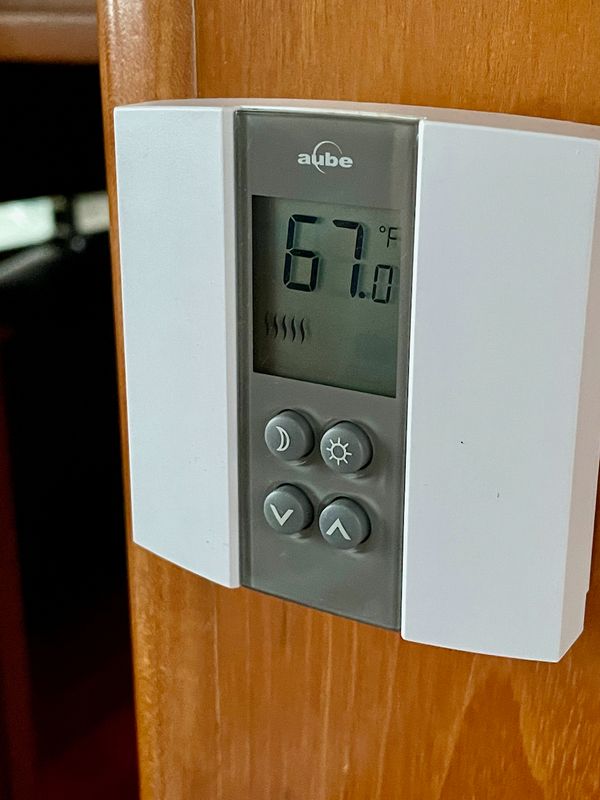
Image resolution: width=600 pixels, height=800 pixels. I want to click on image of an indoor thermostat, so click(109, 417).